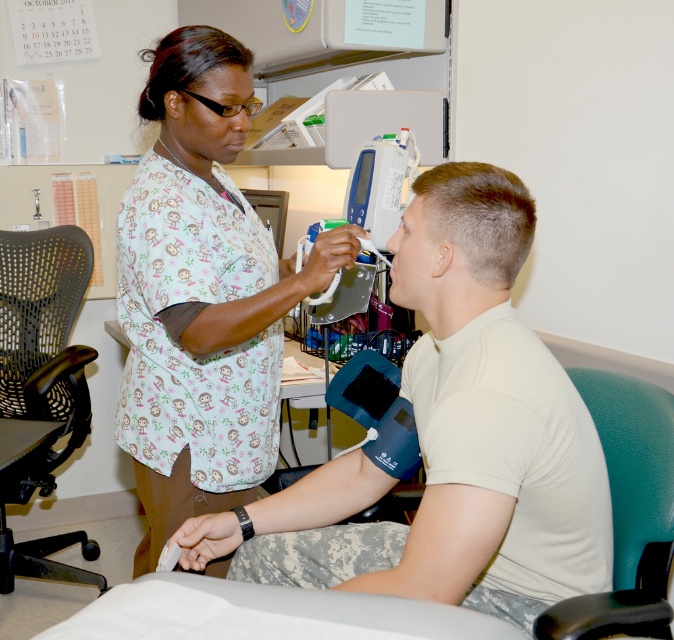
Question: Which point is farther from the camera taking this photo?

Choices:
 (A) (30, 332)
 (B) (245, 301)

Answer: (A)

Question: Which point is closer to the camera?

Choices:
 (A) white printed scrubs at center
 (B) black mesh office chair at left
 (C) teal leather chair at right

Answer: (C)

Question: Which point is closer to the camera?

Choices:
 (A) (210, 285)
 (B) (69, 248)
 (C) (642, 560)

Answer: (C)

Question: Is white printed scrubs at center to the right of teal leather chair at right from the viewer's perspective?

Choices:
 (A) no
 (B) yes

Answer: (A)

Question: Is white printed scrubs at center wider than teal leather chair at right?

Choices:
 (A) yes
 (B) no

Answer: (A)

Question: Is white printed scrubs at center thinner than black mesh office chair at left?

Choices:
 (A) yes
 (B) no

Answer: (B)